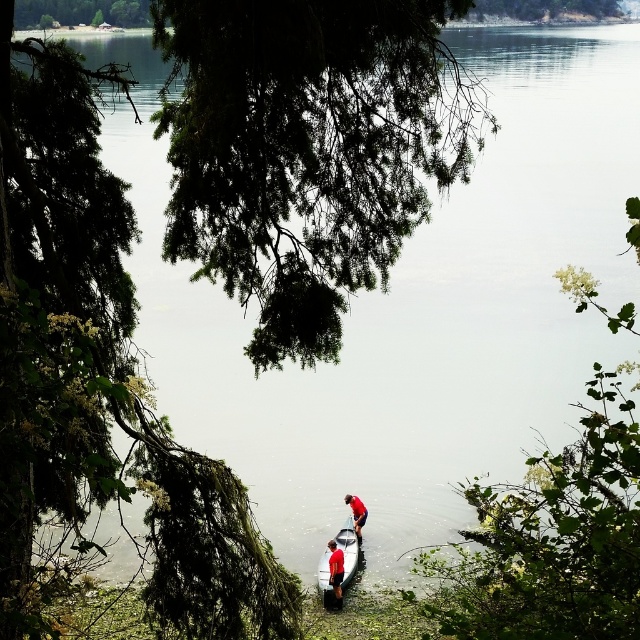
From the picture: Who is more distant from viewer, (170, 209) or (348, 540)?

Point (348, 540)

What do you see at coordinates (305, 148) in the screenshot? I see `green textured leaves at upper center` at bounding box center [305, 148].

At what (x,y) coordinates should I click in order to perform the action: click on green textured leaves at upper center. Please return your answer as a coordinate pair (x, y). The height and width of the screenshot is (640, 640). Looking at the image, I should click on (305, 148).

Who is taller, green textured leaves at upper center or green leafy tree at lower right?

Standing taller between the two is green textured leaves at upper center.

From the picture: Which is below, green textured leaves at upper center or green leafy tree at lower right?

Positioned lower is green leafy tree at lower right.

Does point (333, 257) come closer to viewer compared to point (634, 388)?

No, (333, 257) is further to viewer.

Where is `green textured leaves at upper center`? The image size is (640, 640). green textured leaves at upper center is located at coordinates (305, 148).

In the scene shown: Which of these two, green leafy tree at lower right or red fabric shirt at center, stands taller?

Standing taller between the two is red fabric shirt at center.

This screenshot has width=640, height=640. I want to click on green leafy tree at lower right, so click(554, 538).